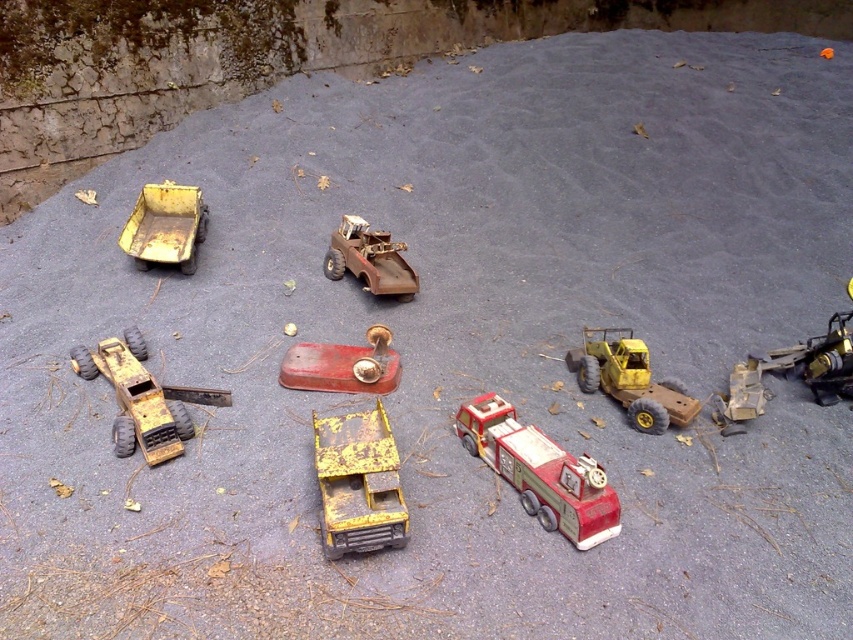
You are a toy collector who wants to place a new toy car that is 2 feet long between the red matte fire truck at center and the yellow matte truck at upper left. Can the new toy car fit in the space between them?

The distance between the red matte fire truck at center and the yellow matte truck at upper left is 5.91 feet. Since the new toy car is only 2 feet long, there is enough space to place it between them.

You are a child who wants to place a new toy car between the yellow matte truck at upper left and the rusty metal truck at center. The toy car is 15 inches long. Can the toy car fit between them without overlapping either truck?

The distance between the yellow matte truck at upper left and the rusty metal truck at center is 30.18 inches. Since the toy car is 15 inches long, there is enough space between them for the toy car to fit without overlapping either truck.

You are standing at the center of the gravel surface and want to locate the yellow matte truck at upper left. Which direction should you look to find it?

You should look towards the upper left direction to find the yellow matte truck at upper left, as it is located at point (x=165, y=227).